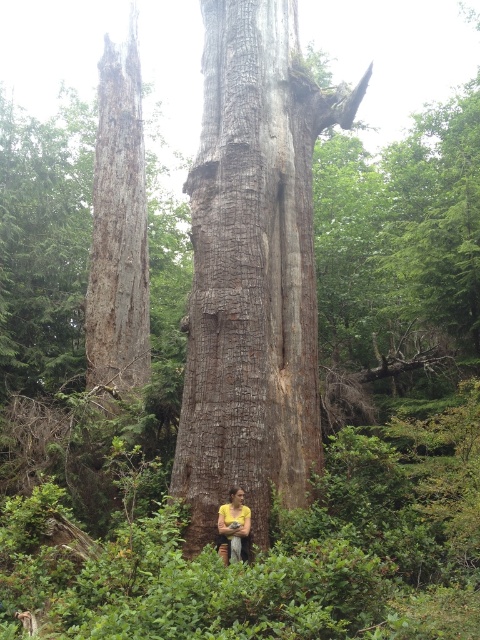
Question: Is rough bark tree trunk at center above yellow fabric person at center?

Choices:
 (A) yes
 (B) no

Answer: (A)

Question: Which point is closer to the camera?

Choices:
 (A) (231, 125)
 (B) (225, 504)

Answer: (B)

Question: Which of the following is the farthest from the observer?

Choices:
 (A) rough bark tree trunk at center
 (B) yellow fabric person at center

Answer: (A)

Question: Does rough bark tree trunk at center appear on the right side of yellow fabric person at center?

Choices:
 (A) no
 (B) yes

Answer: (A)

Question: Is rough bark tree trunk at center to the left of yellow fabric person at center from the viewer's perspective?

Choices:
 (A) no
 (B) yes

Answer: (B)